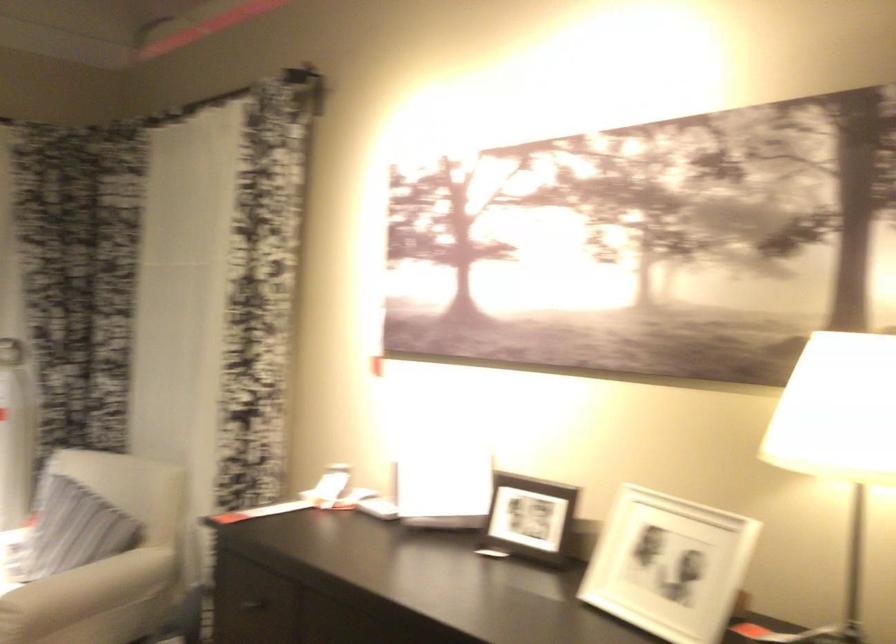
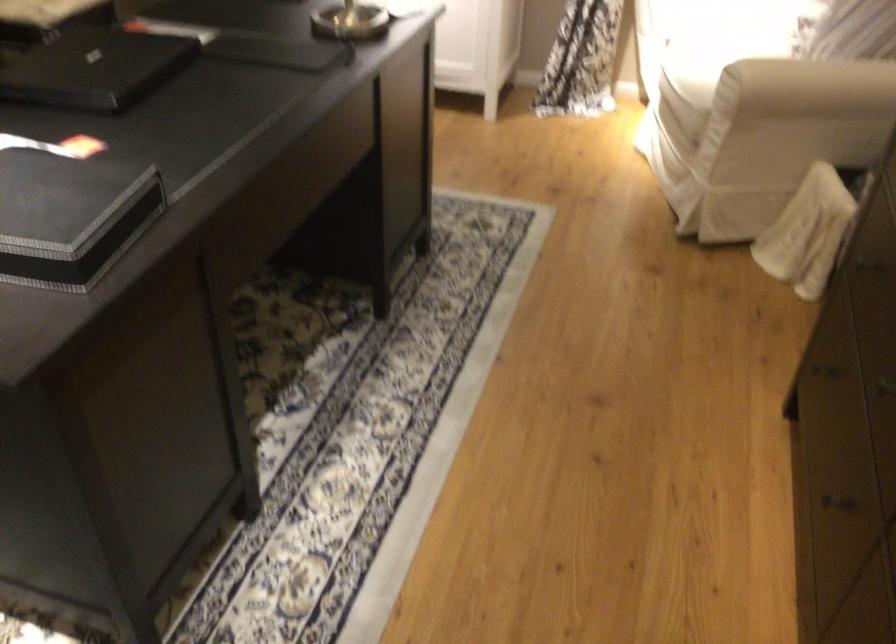
The first image is from the beginning of the video and the second image is from the end. How did the camera likely rotate when shooting the video?

The camera's rotation is toward left-down.